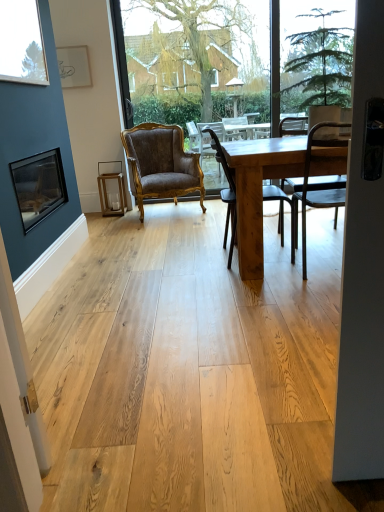
Question: Relative to natural wood table at center, is wooden chair at center, which ranks as the first window screen in back-to-front order, in front or behind?

Choices:
 (A) front
 (B) behind

Answer: (B)

Question: From a real-world perspective, relative to natural wood table at center, is wooden chair at center, which ranks as the first window screen in back-to-front order, vertically above or below?

Choices:
 (A) below
 (B) above

Answer: (B)

Question: Based on their relative distances, which object is farther from the natural wood table at center?

Choices:
 (A) wooden chair at center, which is the 2th window screen in front-to-back order
 (B) black metal chair at right, acting as the 3th chair starting from the back
 (C) clear glass window at upper left
 (D) wooden chair at center, marked as the second chair in a front-to-back arrangement
 (E) matte black picture frame at left

Answer: (A)

Question: Which is nearer to the matte black picture frame at left?

Choices:
 (A) black metal chair at right, which is the first chair from right to left
 (B) velvet gold armchair at center, which ranks as the 3th chair in right-to-left order
 (C) wooden chair at center, the 2th chair positioned from the left
 (D) clear glass window at upper left
 (E) wooden chair at center, which ranks as the first window screen in back-to-front order

Answer: (D)